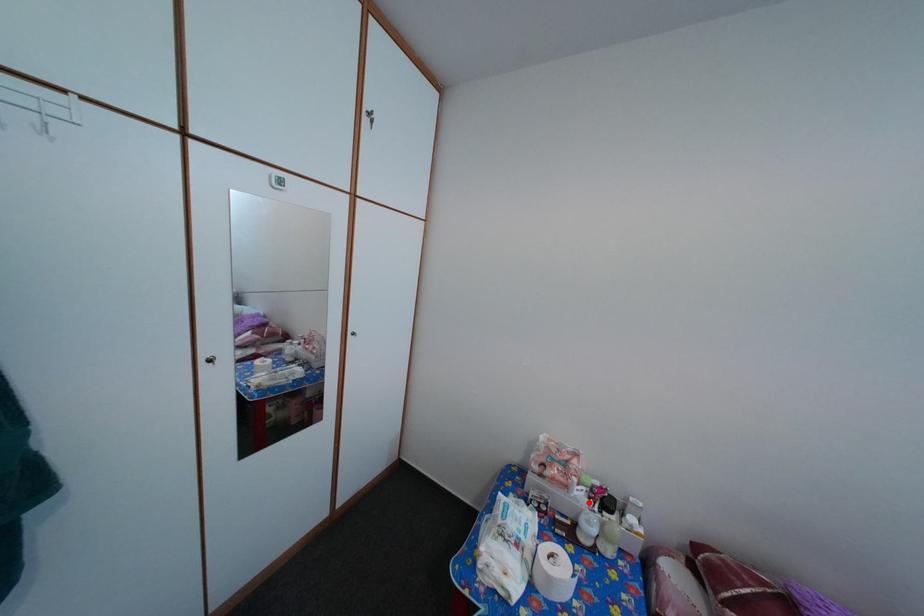
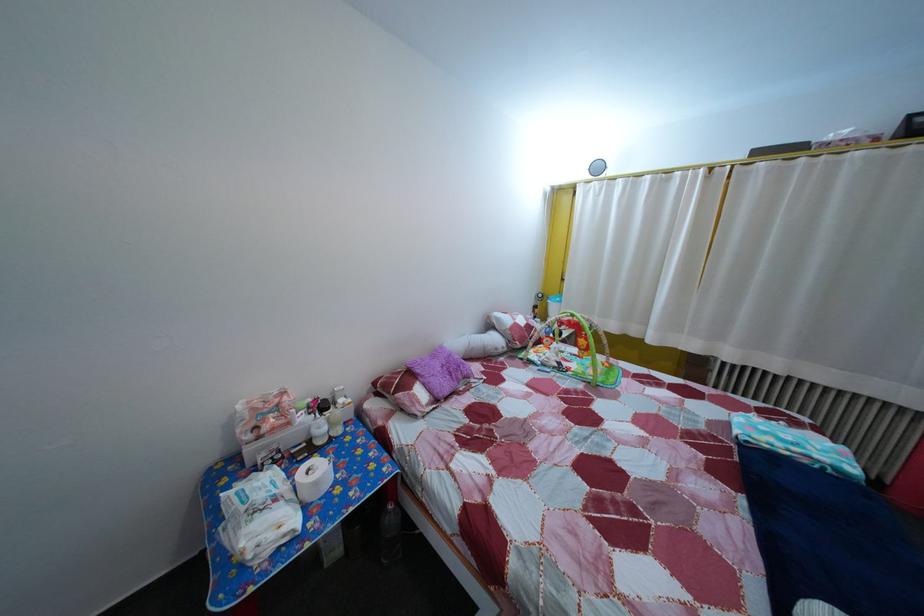
Question: I am providing you with two images of the same scene from different viewpoints. Given a red point in image1, look at the same physical point in image2. Is it:

Choices:
 (A) Closer to the viewpoint
 (B) Farther from the viewpoint

Answer: (A)